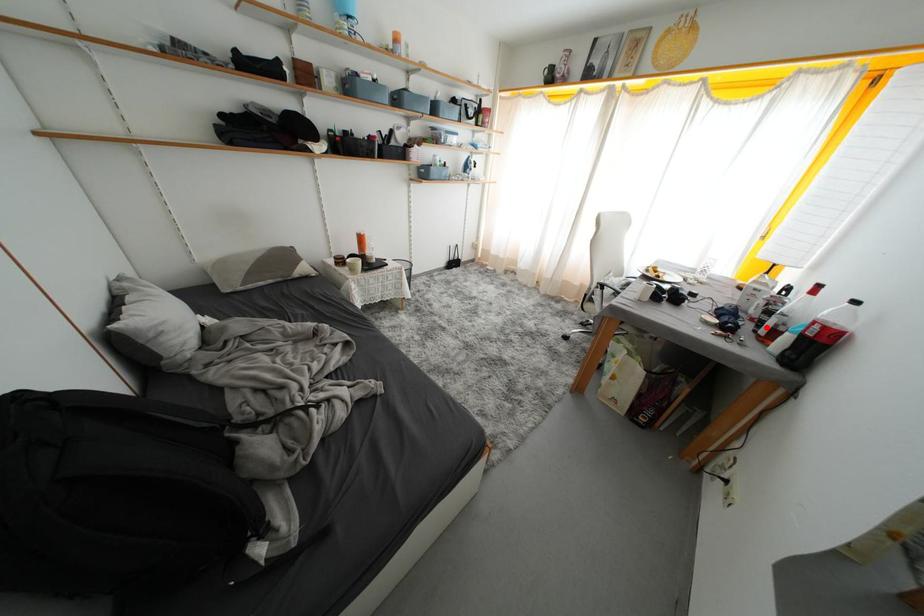
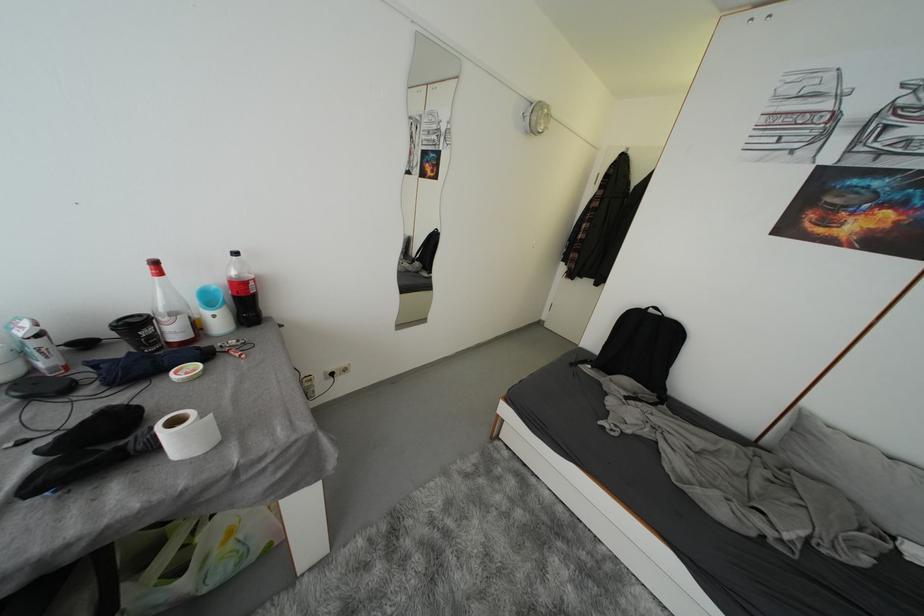
Where in the second image is the point corresponding to the highlighted location from the first image?

(162, 342)